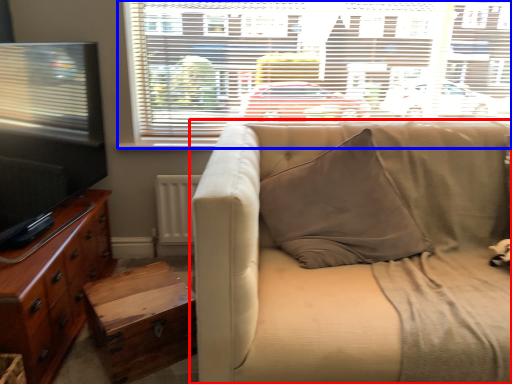
Question: Among these objects, which one is farthest to the camera, studio couch (highlighted by a red box) or window (highlighted by a blue box)?

Choices:
 (A) studio couch
 (B) window

Answer: (B)